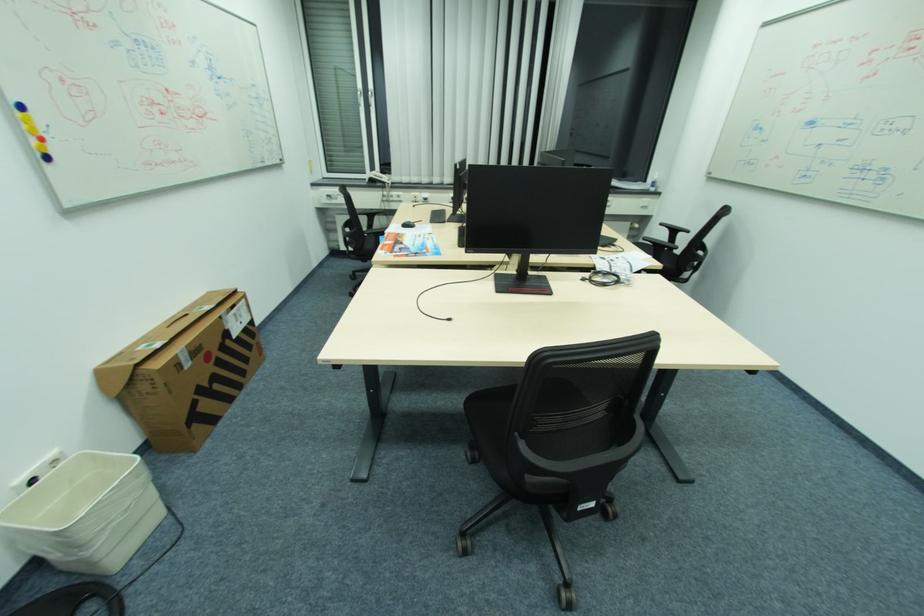
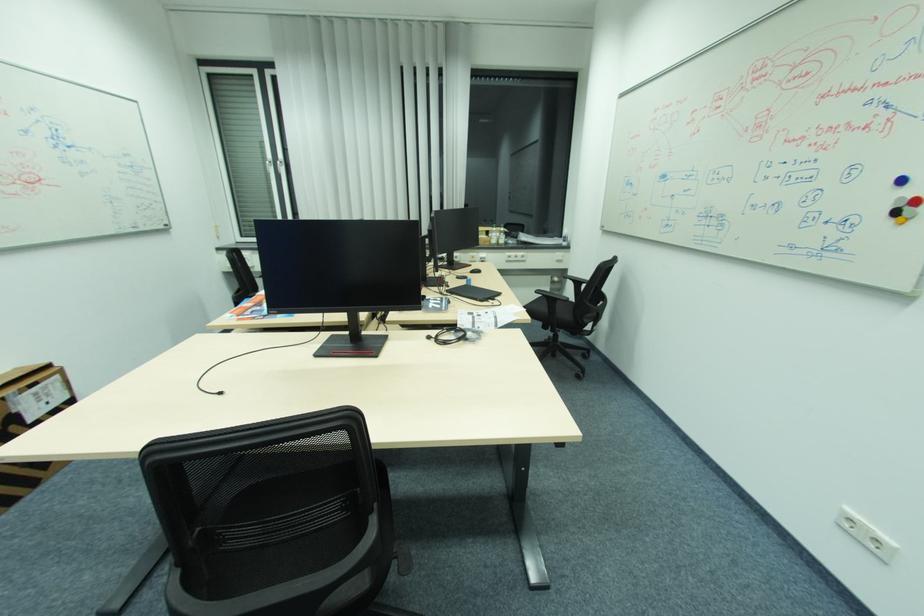
Find the pixel in the second image that matches (x=365, y=92) in the first image.

(275, 163)